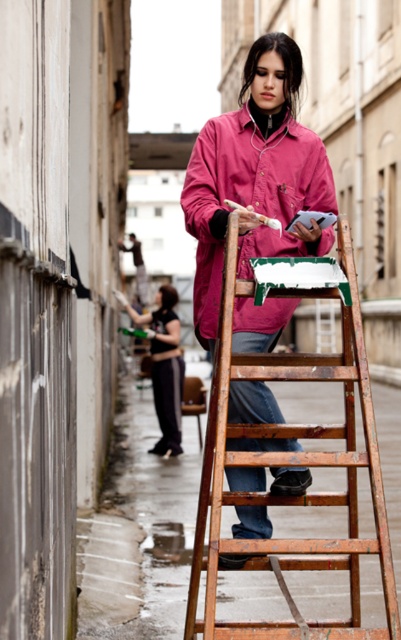
You are a painter in the alleyway. You need to place a 1.2 meter tall sculpture between the wooden at center and the black fabric pants at lower center. Is there enough vertical space between them?

The wooden at center is taller than the black fabric pants at lower center, but the exact vertical distance between them isn

You are a painter in the alleyway. You need to reach the pink matte jacket at center to hand over a tool. However, there is another matte pink jacket at center in the way. Can you reach the lower one without moving the upper one?

The pink matte jacket at center is located below the matte pink jacket at center, so you can reach the lower one without moving the upper one as long as there is enough space between them.